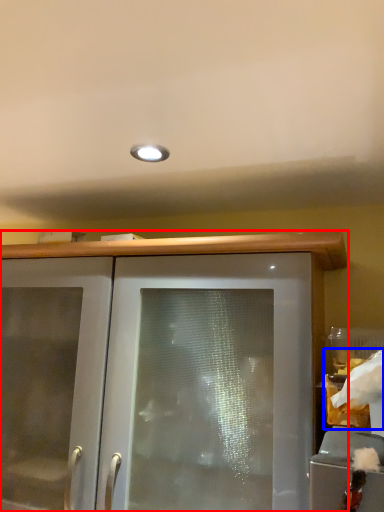
Question: Which of the following is the closest to the observer, cabinetry (highlighted by a red box) or food (highlighted by a blue box)?

Choices:
 (A) cabinetry
 (B) food

Answer: (B)